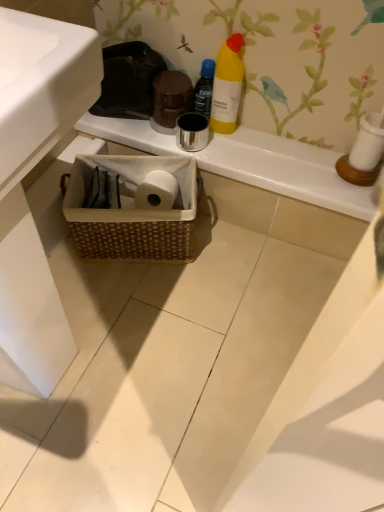
Identify the location of vacant space in front of yellow matte bottle at upper center, which is the 2th bottle in left-to-right order. The width and height of the screenshot is (384, 512). (244, 151).